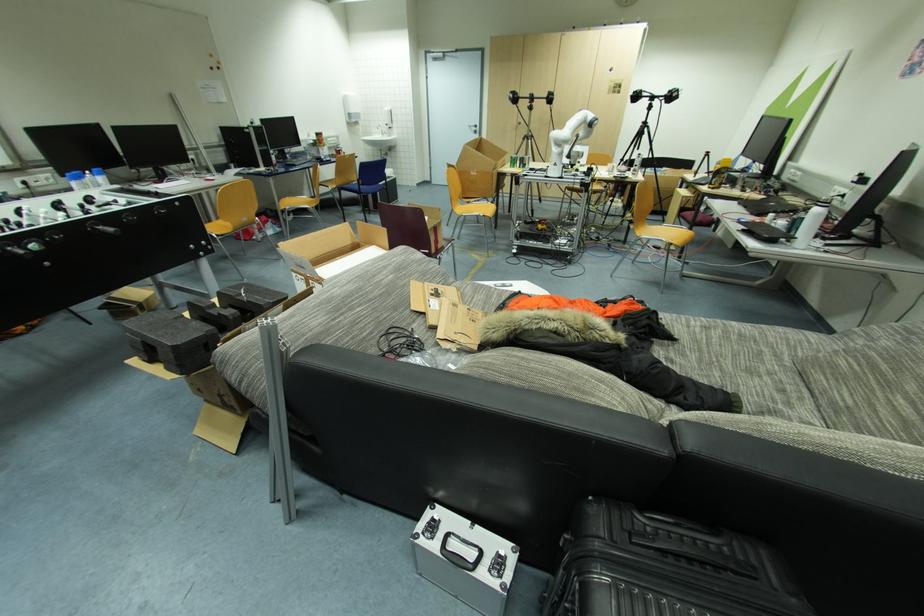
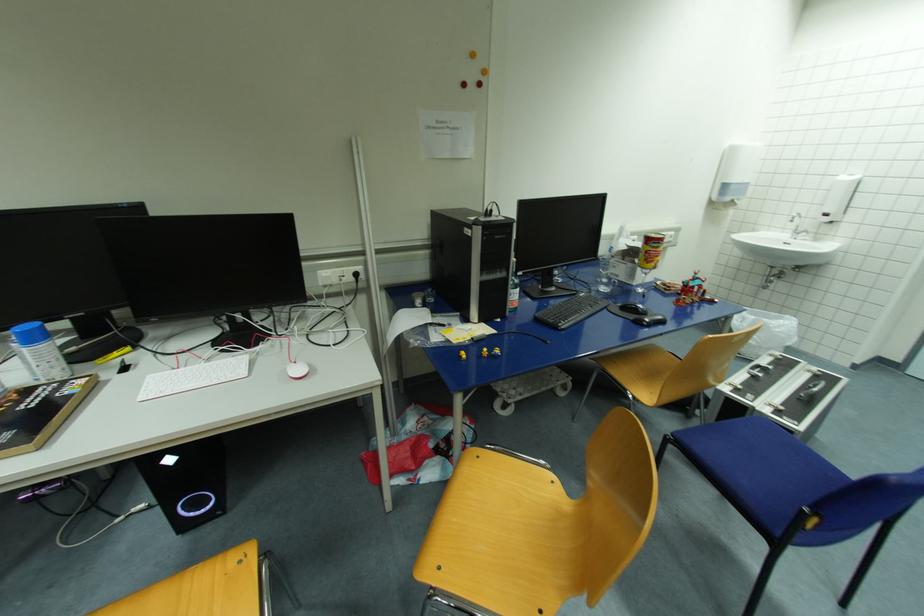
The point at (341, 150) is marked in the first image. Where is the corresponding point in the second image?

(696, 285)